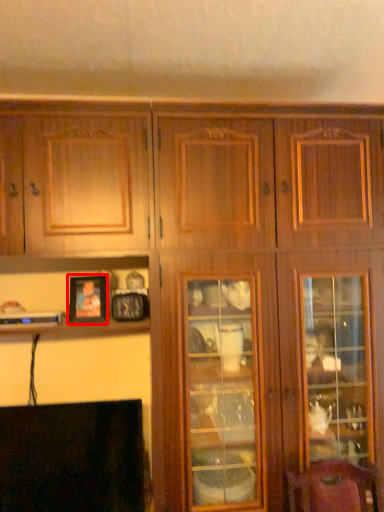
Question: From the image's perspective, what is the correct spatial relationship of picture frame (annotated by the red box) in relation to fireplace?

Choices:
 (A) above
 (B) below

Answer: (A)